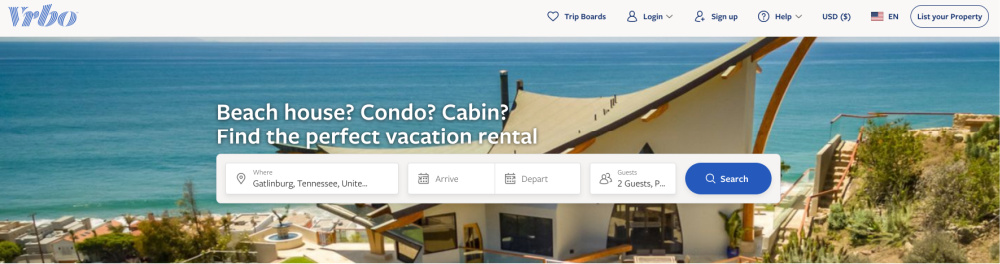
I want to click on round concrete planter, so click(292, 240).